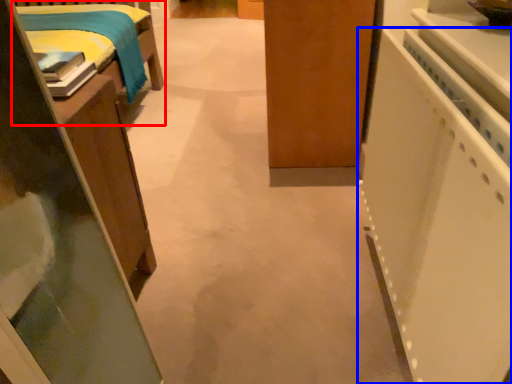
Question: Which object appears closest to the camera in this image, furniture (highlighted by a red box) or appliance (highlighted by a blue box)?

Choices:
 (A) furniture
 (B) appliance

Answer: (B)